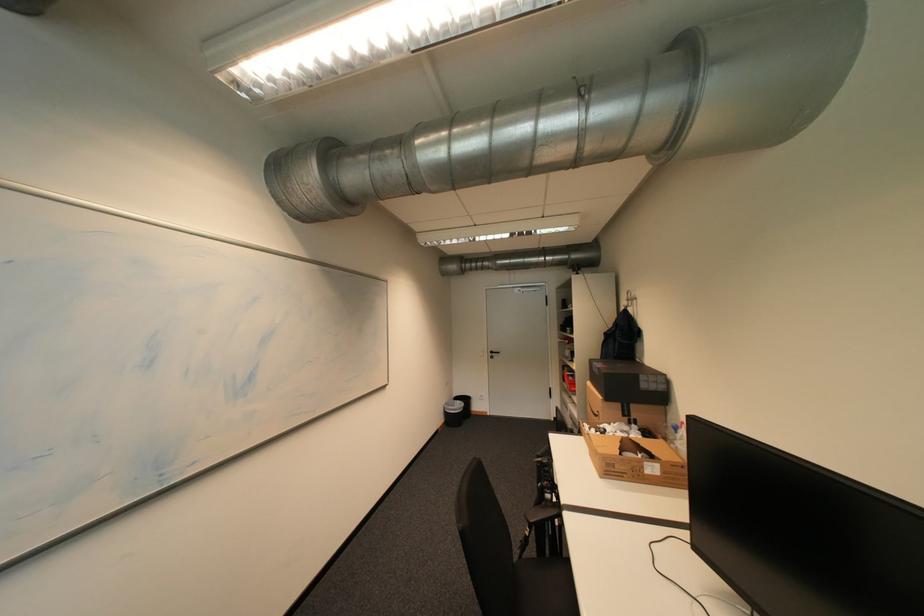
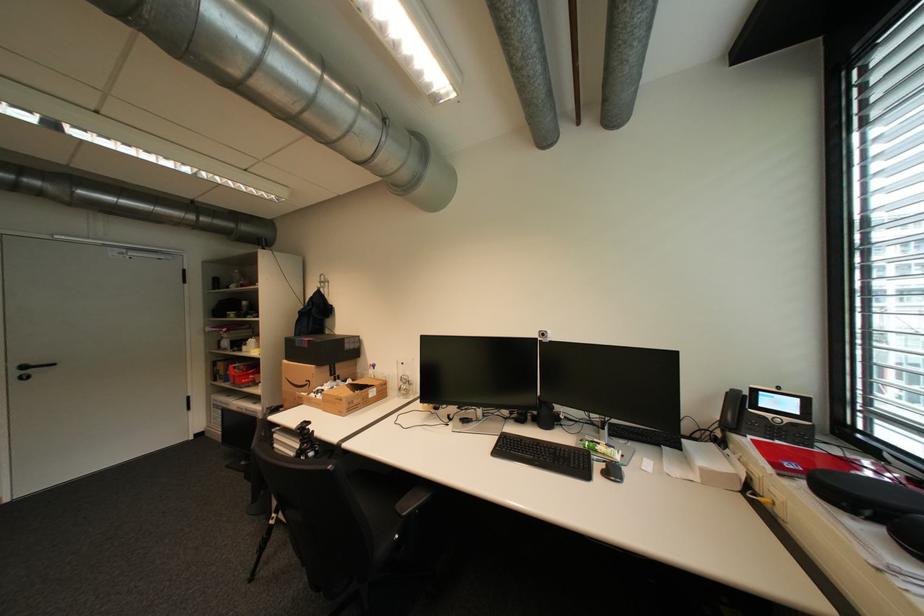
Locate, in the second image, the point that corresponds to (500,353) in the first image.

(32, 368)